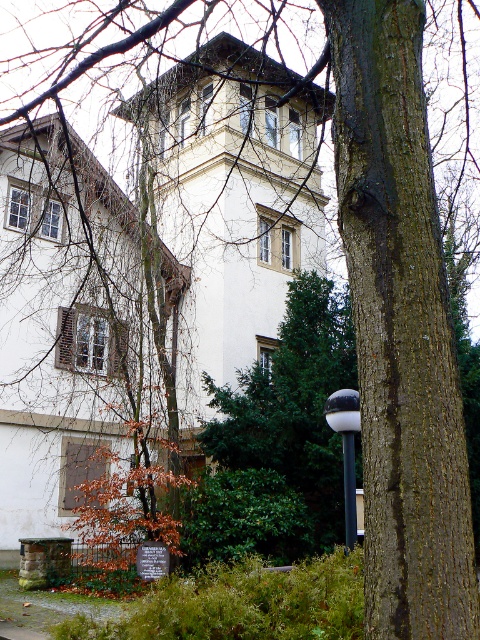
Can you confirm if white smooth building at center is thinner than black metal pole at center?

In fact, white smooth building at center might be wider than black metal pole at center.

Which is in front, point (11, 195) or point (345, 488)?

Point (345, 488) is in front.

Locate an element on the screen. white smooth building at center is located at coordinates (232, 205).

Between white smooth building at center and white glossy lamp post at center right, which one appears on the right side from the viewer's perspective?

From the viewer's perspective, white glossy lamp post at center right appears more on the right side.

Which of these two, white smooth building at center or white glossy lamp post at center right, stands shorter?

white glossy lamp post at center right is shorter.

The width and height of the screenshot is (480, 640). Find the location of `white smooth building at center`. white smooth building at center is located at coordinates (232, 205).

Between white glossy lamp post at center right and black metal pole at center, which one is positioned higher?

white glossy lamp post at center right

Does white glossy lamp post at center right appear on the left side of black metal pole at center?

Incorrect, white glossy lamp post at center right is not on the left side of black metal pole at center.

Is point (347, 451) positioned after point (346, 454)?

No, it is in front of (346, 454).

This screenshot has width=480, height=640. Identify the location of white glossy lamp post at center right. (346, 449).